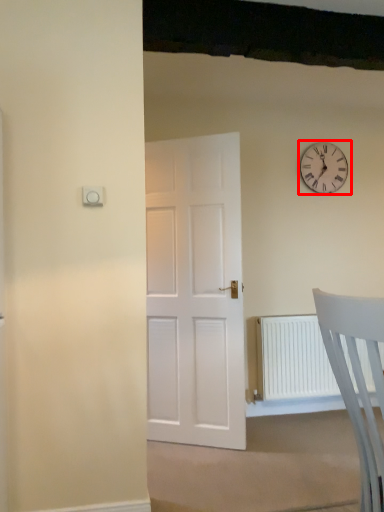
Question: Considering the relative positions of wall clock (annotated by the red box) and chair in the image provided, where is wall clock (annotated by the red box) located with respect to the staircase?

Choices:
 (A) right
 (B) left

Answer: (A)